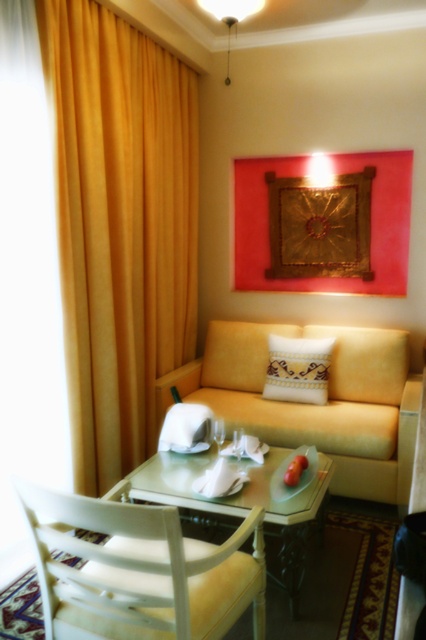
Question: Considering the real-world distances, which object is closest to the light wood table at center?

Choices:
 (A) yellow velvet curtain at left
 (B) embroidered fabric pillow at center
 (C) gold textured fabric at upper center
 (D) white wood chair at lower left

Answer: (D)

Question: Does white wood chair at lower left come in front of matte yellow couch at center?

Choices:
 (A) yes
 (B) no

Answer: (A)

Question: Which object is farther from the camera taking this photo?

Choices:
 (A) yellow velvet curtain at left
 (B) light wood table at center
 (C) white wood chair at lower left
 (D) matte yellow couch at center

Answer: (D)

Question: Does light wood table at center appear over embroidered fabric pillow at center?

Choices:
 (A) no
 (B) yes

Answer: (A)

Question: Among these points, which one is farthest from the camera?

Choices:
 (A) (279, 392)
 (B) (325, 192)
 (C) (259, 474)

Answer: (B)

Question: Can you confirm if gold textured fabric at upper center is thinner than embroidered fabric pillow at center?

Choices:
 (A) no
 (B) yes

Answer: (A)